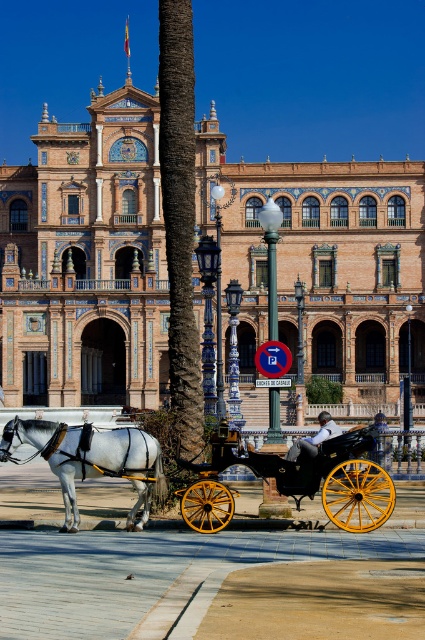
You are standing in front of the grand building and want to take a photo of the shiny gold wheels at center. Where should you position yourself to capture the wheels in the best possible view?

The shiny gold wheels at center are located at point coordinates (294,481), so you should position yourself directly in front of this point to capture the wheels clearly.

You are a tourist standing in front of the golden ornate building at center and the wooden polished coach at center. Which object is bigger in size?

The golden ornate building at center is larger in size compared to the wooden polished coach at center.